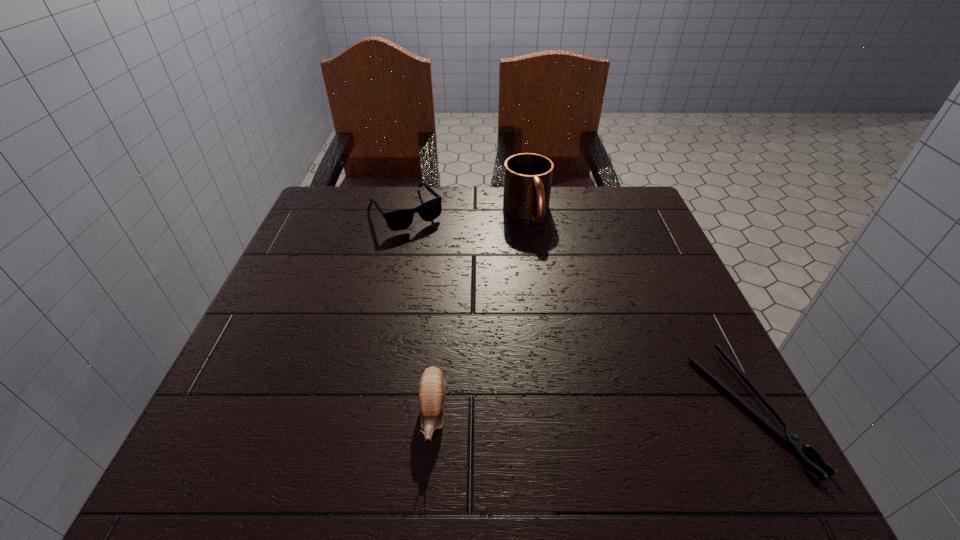
Identify the location of free space between the shortest object and the third tallest object. (578, 309).

You are a GUI agent. You are given a task and a screenshot of the screen. Output one action in this format:
    pyautogui.click(x=<x>, y=<y>)
    Task: Click on the empty space between the second tallest object and the tongs
    
    Given the screenshot: What is the action you would take?
    pyautogui.click(x=591, y=411)

At what (x,y) coordinates should I click in order to perform the action: click on free space that is in between the rightmost object and the escargot. Please return your answer as a coordinate pair (x, y). The image size is (960, 540). Looking at the image, I should click on (591, 411).

Find the location of a particular element. The image size is (960, 540). empty location between the third shortest object and the second shortest object is located at coordinates (420, 312).

Find the location of `free space that is in between the tongs and the tallest object`. free space that is in between the tongs and the tallest object is located at coordinates (638, 310).

The width and height of the screenshot is (960, 540). Identify the location of empty location between the third object from left to right and the tongs. (638, 310).

What are the coordinates of `free space between the escargot and the rightmost object` in the screenshot? It's located at (591, 411).

Identify the location of free space between the second shortest object and the tongs. The image size is (960, 540). (578, 309).

I want to click on object that is the third closest to the shortest object, so click(x=397, y=220).

At what (x,y) coordinates should I click in order to perform the action: click on the third closest object relative to the sunglasses. Please return your answer as a coordinate pair (x, y). The height and width of the screenshot is (540, 960). Looking at the image, I should click on (791, 437).